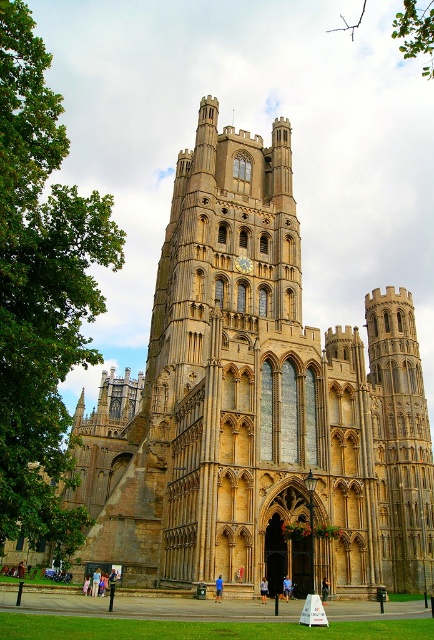
Who is positioned more to the right, green leafy branch at upper center or gold metallic clock at center?

From the viewer's perspective, green leafy branch at upper center appears more on the right side.

Which of these two, green leafy branch at upper center or gold metallic clock at center, stands taller?

With more height is green leafy branch at upper center.

You are a GUI agent. You are given a task and a screenshot of the screen. Output one action in this format:
    pyautogui.click(x=<x>, y=<y>)
    Task: Click on the green leafy branch at upper center
    This screenshot has width=434, height=640.
    Given the screenshot: What is the action you would take?
    pyautogui.click(x=416, y=33)

What do you see at coordinates (40, 292) in the screenshot? I see `green leafy tree at left` at bounding box center [40, 292].

Who is higher up, green leafy tree at left or green leafy branch at upper center?

green leafy branch at upper center is above.

What are the coordinates of `green leafy tree at left` in the screenshot? It's located at (40, 292).

Can you confirm if golden stone church at center is positioned below gold metallic clock at center?

Correct, golden stone church at center is located below gold metallic clock at center.

Based on the photo, who is shorter, golden stone church at center or gold metallic clock at center?

gold metallic clock at center

What do you see at coordinates (257, 403) in the screenshot? This screenshot has height=640, width=434. I see `golden stone church at center` at bounding box center [257, 403].

In order to click on golden stone church at center in this screenshot , I will do `click(257, 403)`.